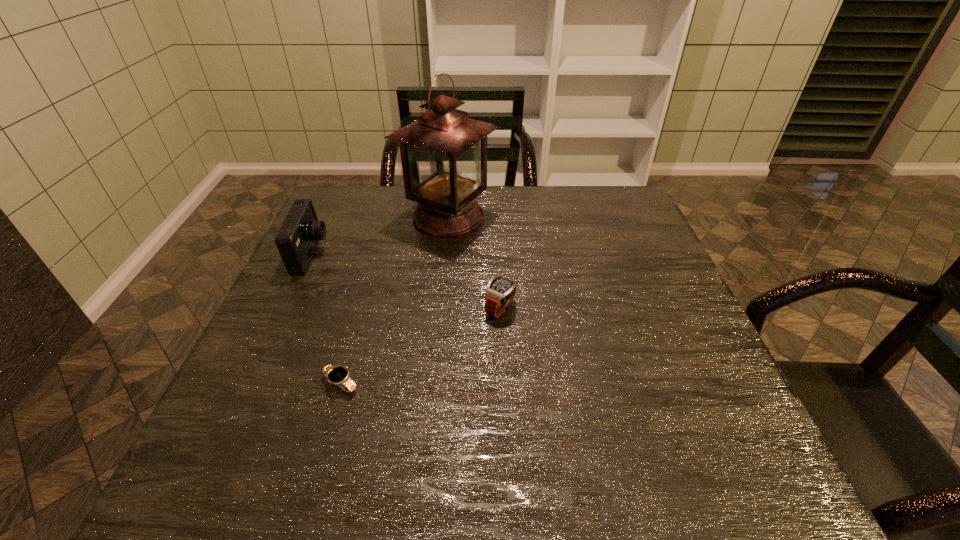
Identify the location of free point between the shortest object and the second nearest object. (420, 346).

Identify the location of free space between the tallest object and the nearer watch. (395, 300).

I want to click on free spot between the leftmost object and the right watch, so click(x=406, y=282).

This screenshot has width=960, height=540. Identify the location of blank region between the nearer watch and the right watch. (420, 346).

You are a GUI agent. You are given a task and a screenshot of the screen. Output one action in this format:
    pyautogui.click(x=<x>, y=<y>)
    Task: Click on the vacant space that's between the taller watch and the oil lamp
    
    Given the screenshot: What is the action you would take?
    pyautogui.click(x=474, y=263)

Locate an element on the screen. Image resolution: width=960 pixels, height=540 pixels. empty space between the leftmost object and the second nearest object is located at coordinates pos(406,282).

Locate an element on the screen. The height and width of the screenshot is (540, 960). vacant point located between the third shortest object and the tallest object is located at coordinates (380, 236).

Locate an element on the screen. free space between the tallest object and the farther watch is located at coordinates (474, 263).

Select which object appears as the second closest to the camera. Please provide its 2D coordinates. Your answer should be formatted as a tuple, i.e. [(x, y)], where the tuple contains the x and y coordinates of a point satisfying the conditions above.

[(339, 375)]

This screenshot has height=540, width=960. I want to click on object that can be found as the second closest to the tallest object, so click(500, 292).